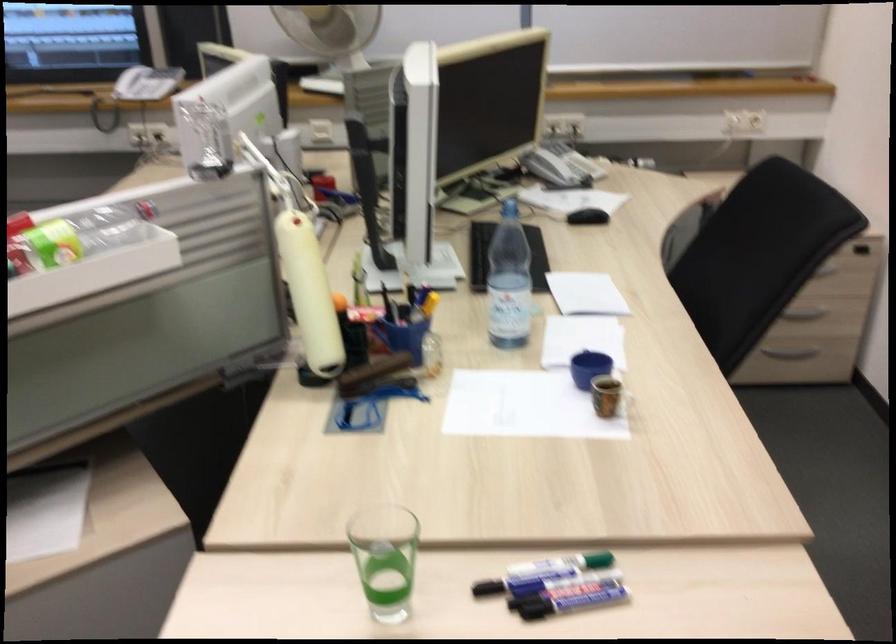
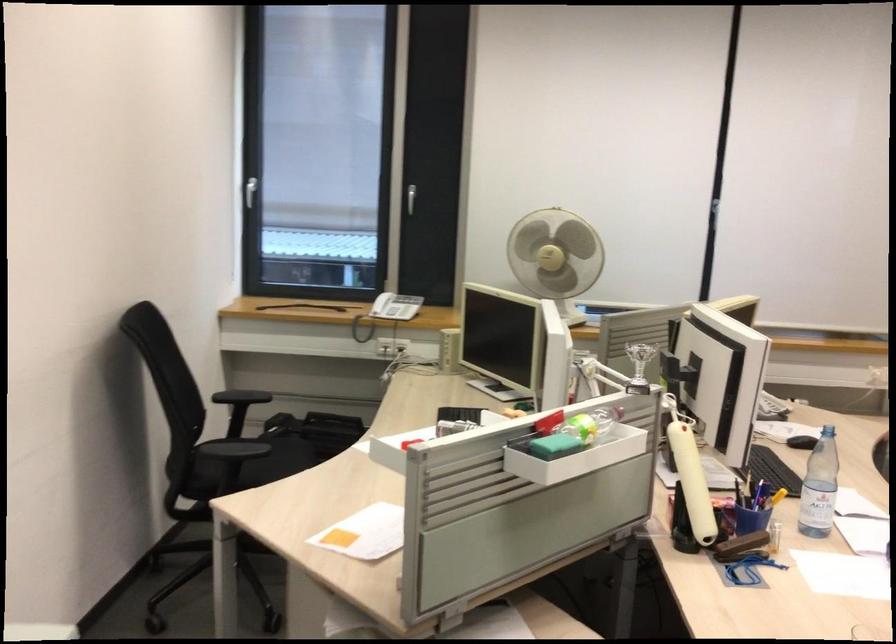
Locate, in the second image, the point that corresponds to (317,285) in the first image.

(690, 475)